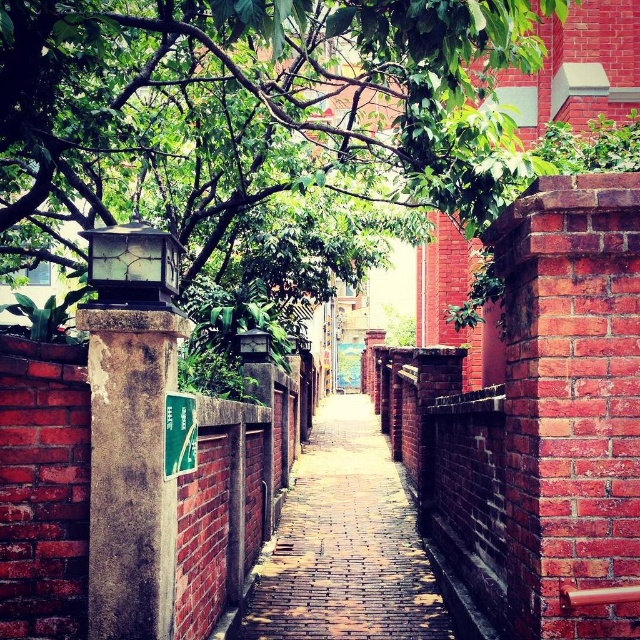
Who is positioned more to the left, green leafy tree at upper left or brick paved walkway at center?

green leafy tree at upper left

Based on the photo, between green leafy tree at upper left and brick paved walkway at center, which one has more height?

With more height is green leafy tree at upper left.

Is point (147, 0) closer to viewer compared to point (276, 588)?

No, (147, 0) is behind (276, 588).

This screenshot has height=640, width=640. I want to click on green leafy tree at upper left, so pos(250,106).